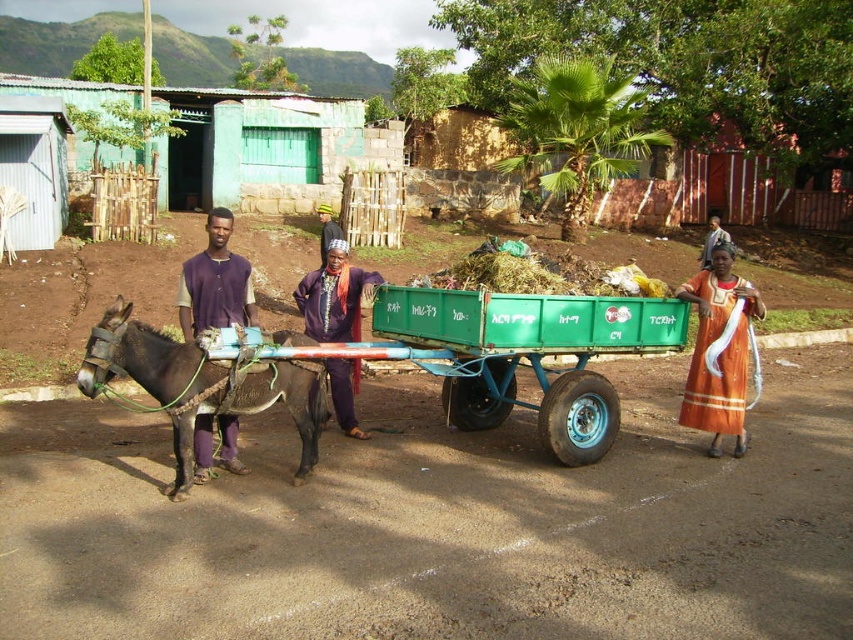
You are a farmer in the scene and need to check both the purple fabric shirt at left and the purple fabric at center. Which one is higher up from the ground?

The purple fabric shirt at left is located above the purple fabric at center, so the purple fabric shirt at left is higher up from the ground.

You are a farmer observing the scene and need to determine which fabric is narrower between the purple fabric at center and the orange fabric dress at right. Which one is narrower?

The purple fabric at center is narrower than the orange fabric dress at right, as it has a lesser width compared to the orange fabric dress at right.